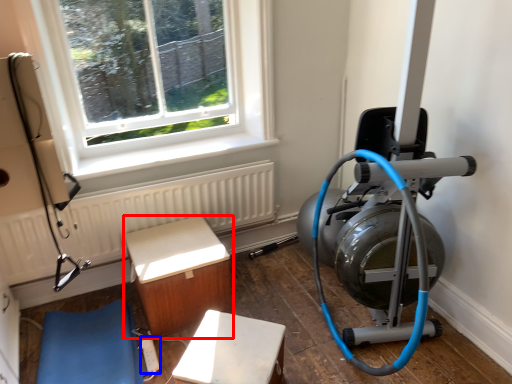
Question: Which object is closer to the camera taking this photo, furniture (highlighted by a red box) or extension cord (highlighted by a blue box)?

Choices:
 (A) furniture
 (B) extension cord

Answer: (B)